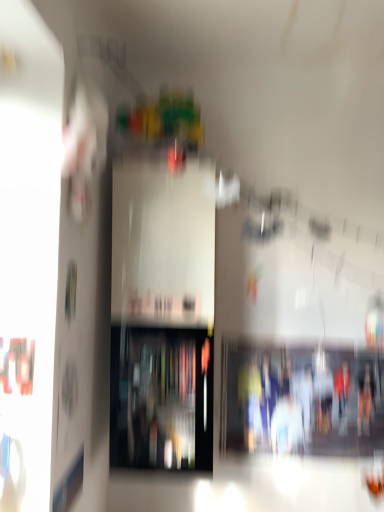
Question: Is transparent glass shelf at center, placed as the 1th shelf when sorted from left to right, next to matte plastic shelf at center, which appears as the 2th shelf when viewed from the left, and touching it?

Choices:
 (A) yes
 (B) no

Answer: (B)

Question: From a real-world perspective, is transparent glass shelf at center, placed as the 1th shelf when sorted from left to right, on top of matte plastic shelf at center, which appears as the 2th shelf when viewed from the left?

Choices:
 (A) yes
 (B) no

Answer: (A)

Question: Is transparent glass shelf at center, which is counted as the 2th shelf, starting from the right, outside of matte plastic shelf at center, which is the 1th shelf from right to left?

Choices:
 (A) no
 (B) yes

Answer: (B)

Question: Can you confirm if transparent glass shelf at center, which is counted as the 2th shelf, starting from the right, is shorter than matte plastic shelf at center, which is the 1th shelf from right to left?

Choices:
 (A) yes
 (B) no

Answer: (B)

Question: Considering the relative sizes of transparent glass shelf at center, placed as the 1th shelf when sorted from left to right, and matte plastic shelf at center, which is the 1th shelf from right to left, in the image provided, is transparent glass shelf at center, placed as the 1th shelf when sorted from left to right, taller than matte plastic shelf at center, which is the 1th shelf from right to left,?

Choices:
 (A) no
 (B) yes

Answer: (B)

Question: Does transparent glass shelf at center, placed as the 1th shelf when sorted from left to right, appear on the left side of matte plastic shelf at center, which appears as the 2th shelf when viewed from the left?

Choices:
 (A) yes
 (B) no

Answer: (A)

Question: Is matte plastic shelf at center, which appears as the 2th shelf when viewed from the left, not within transparent glass shelf at center, which is counted as the 2th shelf, starting from the right?

Choices:
 (A) yes
 (B) no

Answer: (A)

Question: From the image's perspective, would you say matte plastic shelf at center, which appears as the 2th shelf when viewed from the left, is shown under transparent glass shelf at center, which is counted as the 2th shelf, starting from the right?

Choices:
 (A) yes
 (B) no

Answer: (A)

Question: Is the surface of matte plastic shelf at center, which appears as the 2th shelf when viewed from the left, in direct contact with transparent glass shelf at center, which is counted as the 2th shelf, starting from the right?

Choices:
 (A) no
 (B) yes

Answer: (A)

Question: Does matte plastic shelf at center, which appears as the 2th shelf when viewed from the left, have a greater width compared to transparent glass shelf at center, which is counted as the 2th shelf, starting from the right?

Choices:
 (A) no
 (B) yes

Answer: (A)

Question: Is the depth of matte plastic shelf at center, which is the 1th shelf from right to left, greater than that of transparent glass shelf at center, which is counted as the 2th shelf, starting from the right?

Choices:
 (A) no
 (B) yes

Answer: (B)

Question: Is matte plastic shelf at center, which is the 1th shelf from right to left, turned away from transparent glass shelf at center, placed as the 1th shelf when sorted from left to right?

Choices:
 (A) yes
 (B) no

Answer: (B)

Question: From a real-world perspective, is transparent glass shelf at center, placed as the 1th shelf when sorted from left to right, above or below matte plastic shelf at center, which appears as the 2th shelf when viewed from the left?

Choices:
 (A) below
 (B) above

Answer: (B)